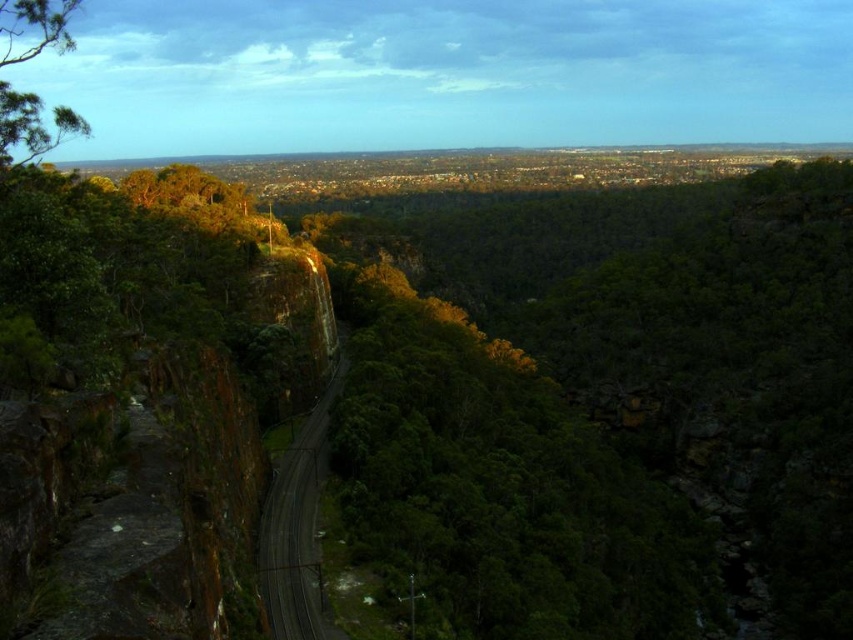
Question: Is green leafy tree at center to the right of green leafy tree at upper left from the viewer's perspective?

Choices:
 (A) yes
 (B) no

Answer: (A)

Question: From the image, what is the correct spatial relationship of green leafy tree at center in relation to green leafy tree at upper left?

Choices:
 (A) above
 (B) below

Answer: (A)

Question: Which of the following is the closest to the observer?

Choices:
 (A) (15, 138)
 (B) (811, 321)

Answer: (A)

Question: Which object appears farthest from the camera in this image?

Choices:
 (A) green leafy tree at upper left
 (B) green leafy tree at center

Answer: (B)

Question: Is green leafy tree at center positioned at the back of green leafy tree at upper left?

Choices:
 (A) no
 (B) yes

Answer: (B)

Question: Among these objects, which one is nearest to the camera?

Choices:
 (A) green leafy tree at upper left
 (B) green leafy tree at center

Answer: (A)